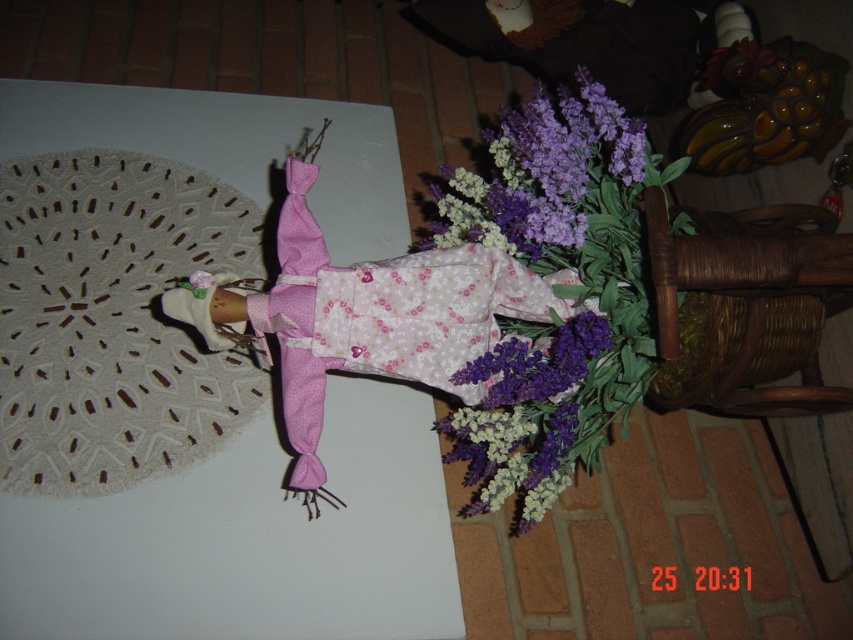
Question: Among these objects, which one is farthest from the camera?

Choices:
 (A) pink fabric dress at center
 (B) purple matte flowers at upper center
 (C) lavender bouquet at center

Answer: (B)

Question: Which object is farther from the camera taking this photo?

Choices:
 (A) lavender bouquet at center
 (B) purple matte flowers at upper center
 (C) pink fabric dress at center

Answer: (B)

Question: Does lavender bouquet at center appear over pink fabric dress at center?

Choices:
 (A) yes
 (B) no

Answer: (A)

Question: Which point is closer to the camera?

Choices:
 (A) lavender bouquet at center
 (B) pink fabric dress at center
 (C) purple matte flowers at upper center

Answer: (B)

Question: Is lavender bouquet at center smaller than pink fabric dress at center?

Choices:
 (A) no
 (B) yes

Answer: (A)

Question: Is the position of pink fabric dress at center less distant than that of purple matte flowers at upper center?

Choices:
 (A) no
 (B) yes

Answer: (B)